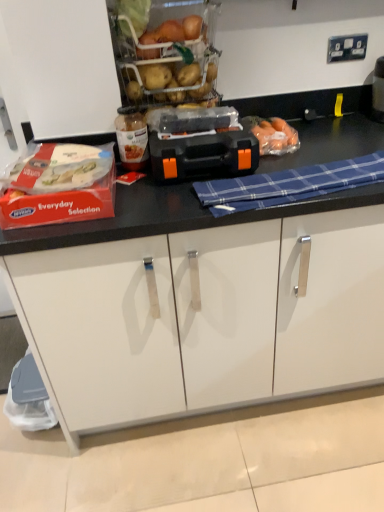
Question: Should I look upward or downward to see black plastic toolbox at center?

Choices:
 (A) down
 (B) up

Answer: (B)

Question: Considering the relative sizes of blue plaid cloth at center and translucent glass jar at center in the image provided, is blue plaid cloth at center thinner than translucent glass jar at center?

Choices:
 (A) no
 (B) yes

Answer: (A)

Question: Can we say blue plaid cloth at center lies outside translucent glass jar at center?

Choices:
 (A) yes
 (B) no

Answer: (A)

Question: Is blue plaid cloth at center shorter than translucent glass jar at center?

Choices:
 (A) yes
 (B) no

Answer: (A)

Question: Would you say translucent glass jar at center is part of blue plaid cloth at center's contents?

Choices:
 (A) yes
 (B) no

Answer: (B)

Question: Considering the relative sizes of blue plaid cloth at center and translucent glass jar at center in the image provided, is blue plaid cloth at center taller than translucent glass jar at center?

Choices:
 (A) no
 (B) yes

Answer: (A)

Question: Does blue plaid cloth at center have a smaller size compared to translucent glass jar at center?

Choices:
 (A) no
 (B) yes

Answer: (A)

Question: Is white matte cabinet at lower center at the right side of black plastic toolbox at center?

Choices:
 (A) no
 (B) yes

Answer: (A)

Question: From a real-world perspective, is white matte cabinet at lower center beneath black plastic toolbox at center?

Choices:
 (A) yes
 (B) no

Answer: (A)

Question: Can we say white matte cabinet at lower center lies outside black plastic toolbox at center?

Choices:
 (A) no
 (B) yes

Answer: (B)

Question: Is white matte cabinet at lower center closer to camera compared to black plastic toolbox at center?

Choices:
 (A) yes
 (B) no

Answer: (B)

Question: Does white matte cabinet at lower center appear on the left side of black plastic toolbox at center?

Choices:
 (A) no
 (B) yes

Answer: (B)

Question: Is white matte cabinet at lower center further to the viewer compared to black plastic toolbox at center?

Choices:
 (A) no
 (B) yes

Answer: (B)

Question: From a real-world perspective, does translucent glass jar at center stand above white matte cabinet at lower center?

Choices:
 (A) yes
 (B) no

Answer: (A)